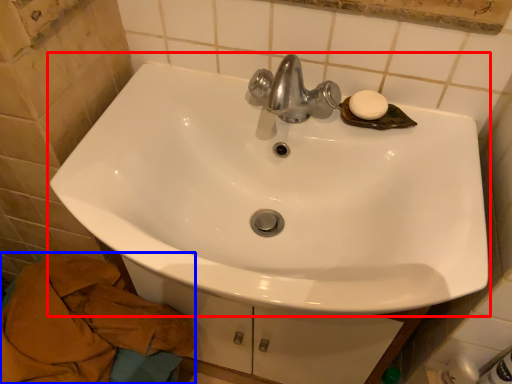
Question: Which of the following is the farthest to the observer, sink (highlighted by a red box) or bath towel (highlighted by a blue box)?

Choices:
 (A) sink
 (B) bath towel

Answer: (B)